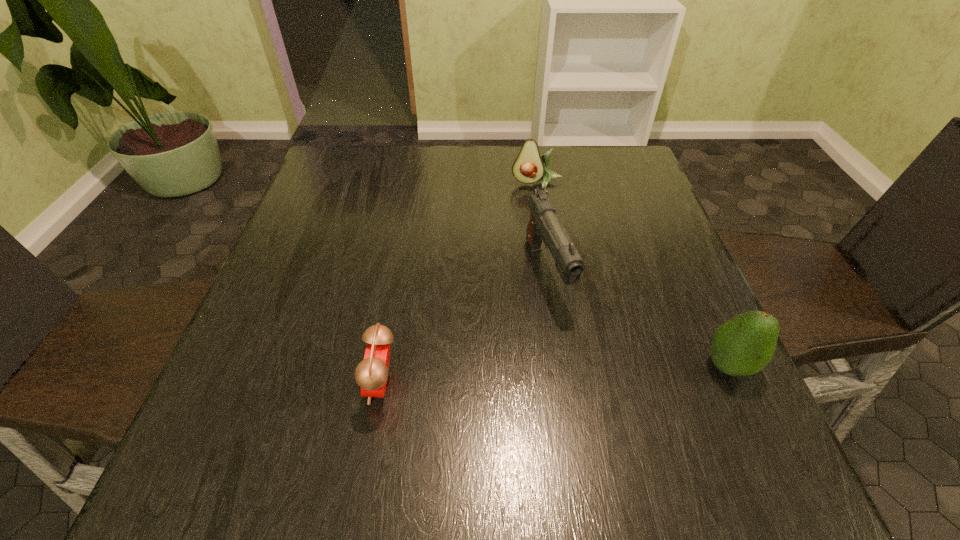
Locate an element on the screen. The height and width of the screenshot is (540, 960). vacant space on the desktop that is between the leftmost object and the rightmost object and is positioned on the seed side of the farthest object is located at coordinates (519, 377).

You are a GUI agent. You are given a task and a screenshot of the screen. Output one action in this format:
    pyautogui.click(x=<x>, y=<y>)
    Task: Click on the vacant spot on the desktop that is between the alarm clock and the right avocado and is positioned in the direction the gun is aimed
    
    Given the screenshot: What is the action you would take?
    pyautogui.click(x=592, y=373)